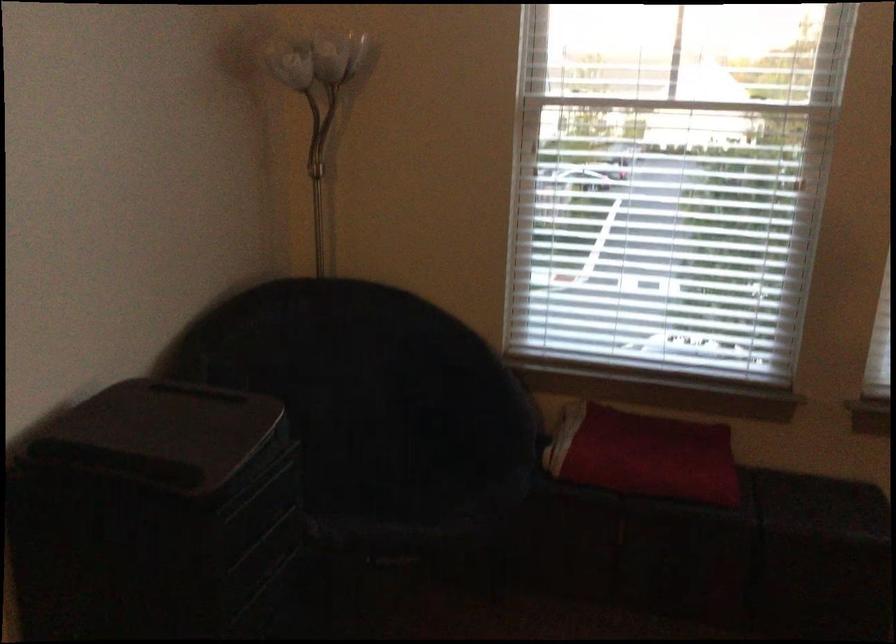
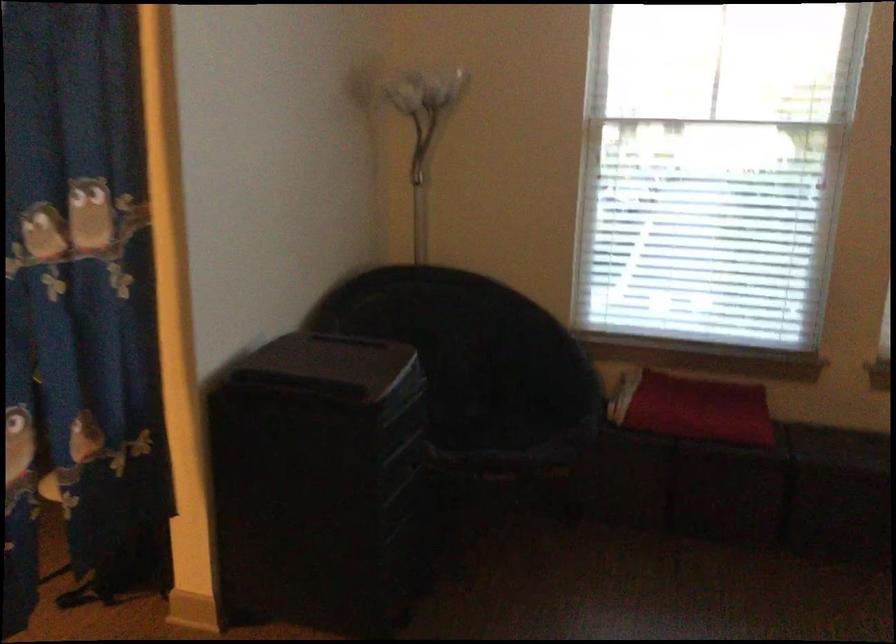
Which direction would the cameraman need to move to produce the second image?

The cameraman walked toward left, backward.